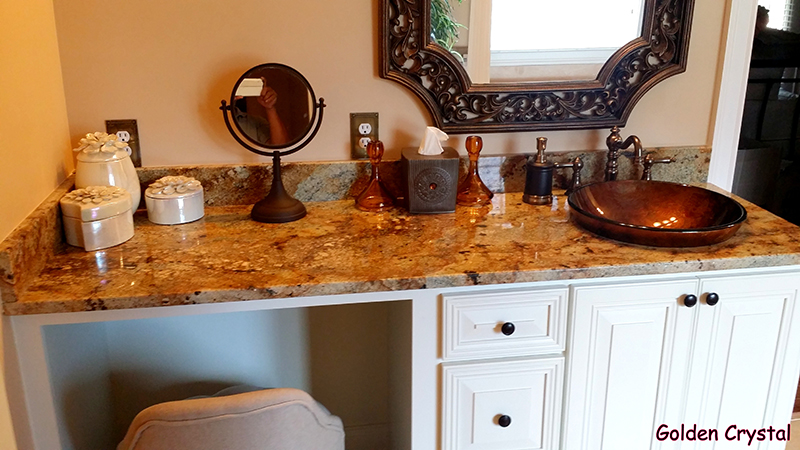
The image size is (800, 450). What are the coordinates of `orange wall` in the screenshot? It's located at (30, 99).